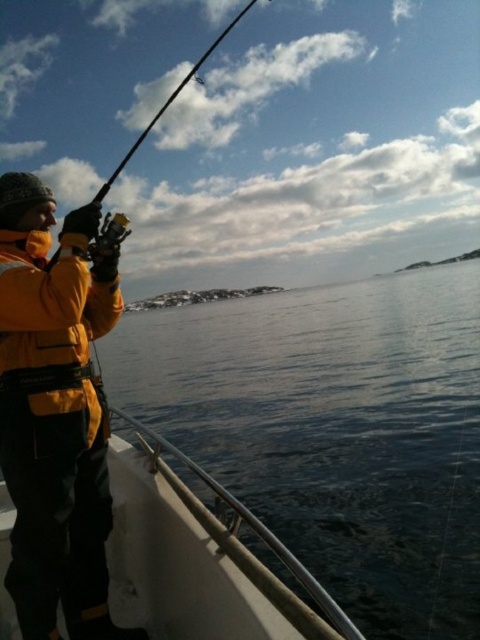
Can you confirm if transparent water at lower center is thinner than yellow matte jacket at left?

No.

Who is positioned more to the left, transparent water at lower center or yellow matte jacket at left?

yellow matte jacket at left

The image size is (480, 640). I want to click on transparent water at lower center, so (x=335, y=426).

Is point (427, 284) positioned before point (160, 442)?

That is False.

Who is shorter, transparent water at lower center or white matte boat at lower left?

Standing shorter between the two is white matte boat at lower left.

I want to click on transparent water at lower center, so click(x=335, y=426).

Who is lower down, yellow matte jacket at left or white matte boat at lower left?

Positioned lower is white matte boat at lower left.

Does yellow matte jacket at left have a smaller size compared to white matte boat at lower left?

Actually, yellow matte jacket at left might be larger than white matte boat at lower left.

Is point (47, 339) closer to viewer compared to point (265, 538)?

No, it is not.

Locate an element on the screen. This screenshot has height=640, width=480. yellow matte jacket at left is located at coordinates (55, 413).